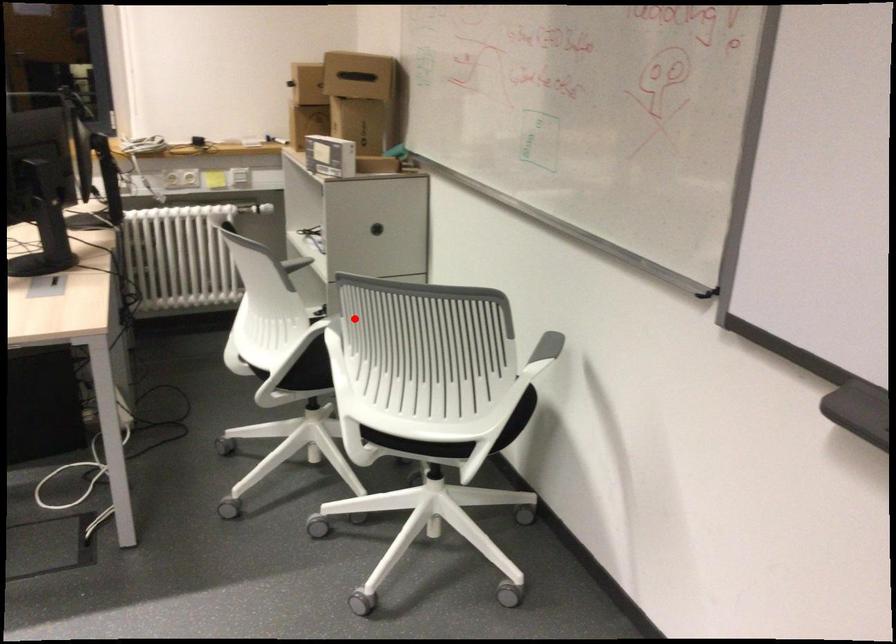
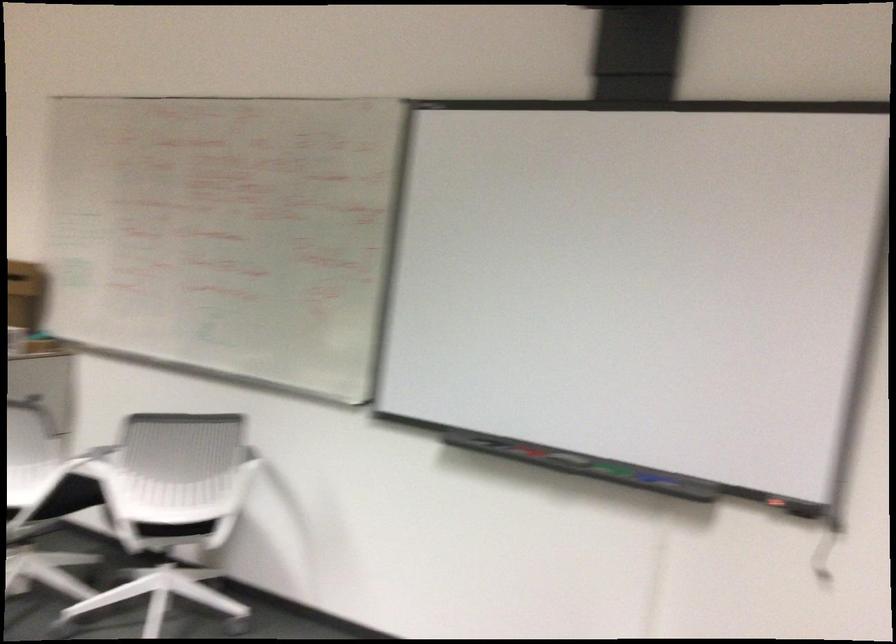
Question: I am providing you with two images of the same scene from different viewpoints. A red point is shown in image1. For the corresponding object point in image2, is it positioned nearer or farther from the camera?

Choices:
 (A) Nearer
 (B) Farther

Answer: (B)